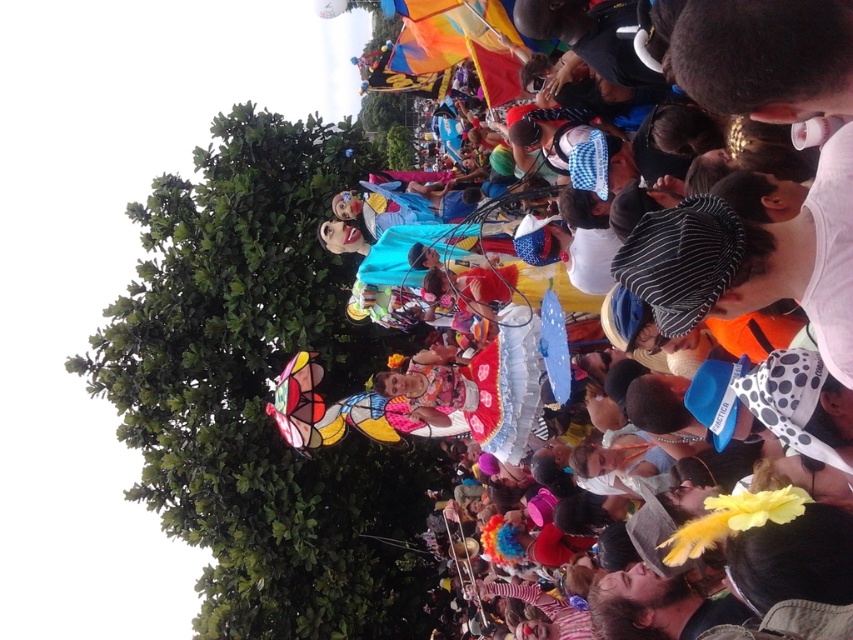
You are standing at the center of the scene and looking towards the green leafy tree at upper left. Which direction should you turn to face the tree?

The green leafy tree at upper left is located at point (262,394), so you should turn to your left to face the tree.

You are standing in the crowd at the festive event and want to take a photo of both the point at coordinates [175,490] and the point at coordinates [827,28]. Based on their positions, which point is closer to you?

The point at coordinates [175,490] is closer to you because it is further to the camera than the point at coordinates [827,28].

You are a photographer trying to capture a photo of the matte colorful costumes at center without the green leafy tree at upper left blocking the view. Can you adjust your position to do so?

The green leafy tree at upper left might be wider than matte colorful costumes at center, so adjusting your position might help avoid the tree blocking the view.